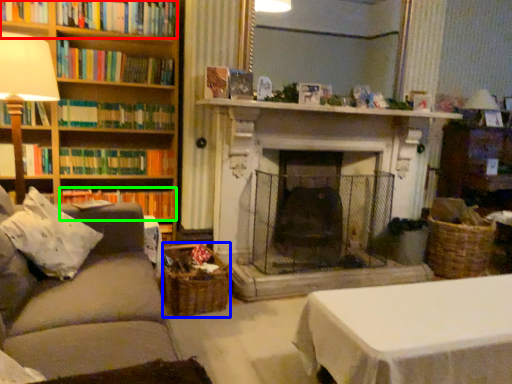
Question: Which object is positioned farthest from book (highlighted by a red box)? Select from basket (highlighted by a blue box) and book (highlighted by a green box).

Choices:
 (A) basket
 (B) book

Answer: (A)